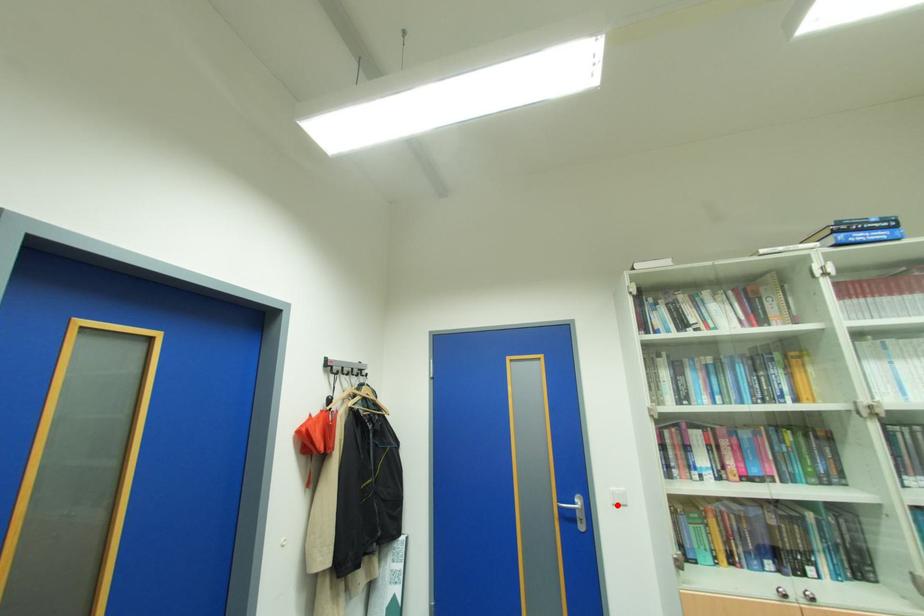
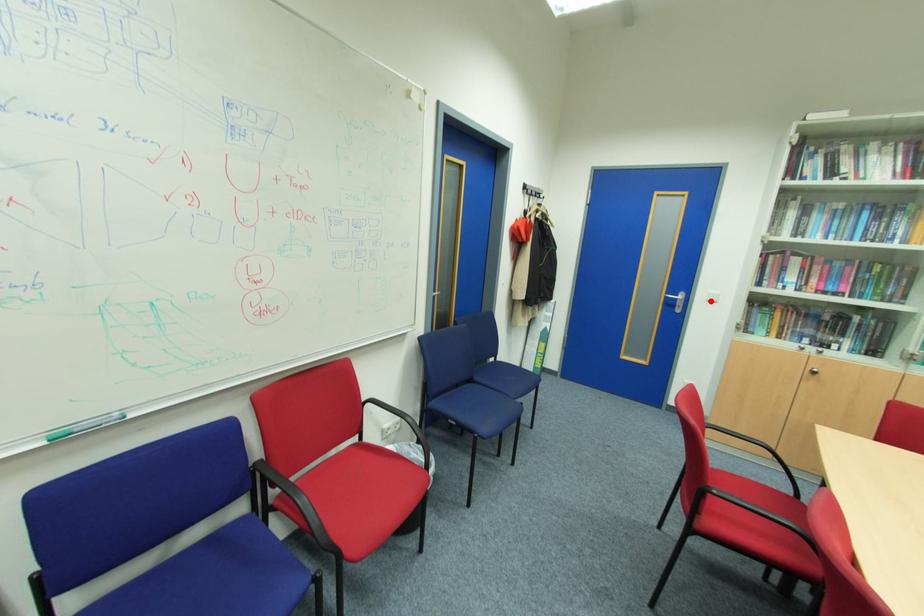
I am providing you with two images of the same scene from different viewpoints. A red point is marked on the first image and another point is marked on the second image. Is the marked point in image1 the same physical position as the marked point in image2?

Yes